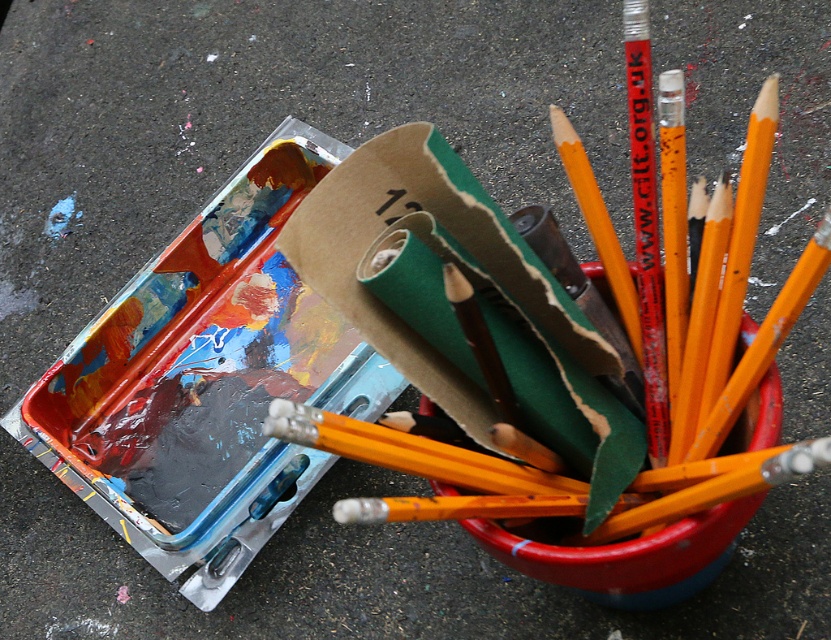
You are an artist trying to reach for your tools. You see the yellow wood paint brush at upper center and the yellow wood pencil at upper right. Which one is closer to you?

The yellow wood paint brush at upper center is closer to the viewer than the yellow wood pencil at upper right.

You are standing in front of the workspace and want to reach both points. Which point, point (750, 208) or point (564, 500), will you reach first?

Point (750, 208) is further to the viewer than point (564, 500), so you will reach point (750, 208) first.

You are an artist trying to choose between the yellow wood paint brush at upper center and the yellow wood pencil at upper right for a detailed drawing. Which tool is more suitable for precise lines?

The yellow wood pencil at upper right is more suitable for precise lines because it is narrower than the yellow wood paint brush at upper center.